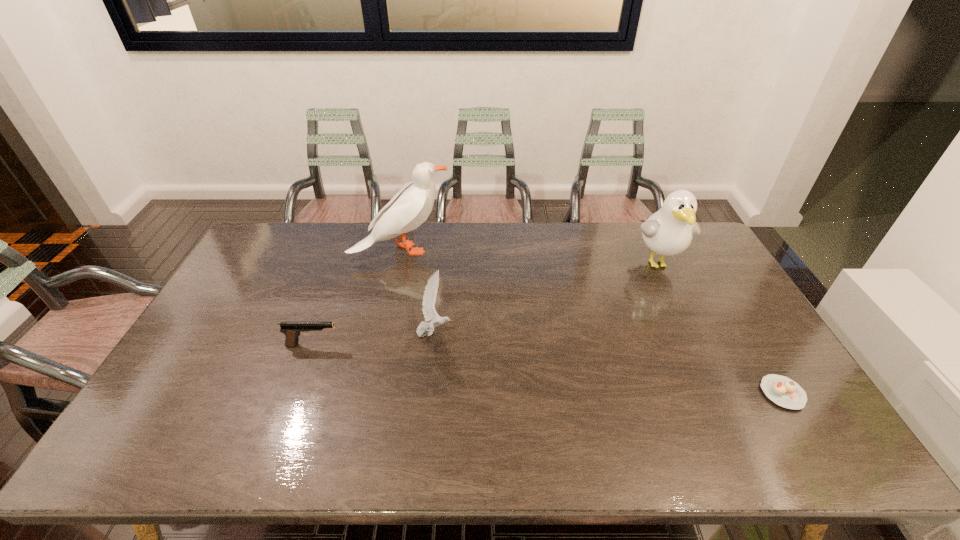
The height and width of the screenshot is (540, 960). Identify the location of the second object from right to left. (668, 232).

Find the location of `the nearest gull`. the nearest gull is located at coordinates (429, 298).

Identify the location of the shortest gull. The height and width of the screenshot is (540, 960). (429, 298).

The image size is (960, 540). Find the location of `the fourth tallest object`. the fourth tallest object is located at coordinates (292, 330).

Where is `the rightmost object`? The width and height of the screenshot is (960, 540). the rightmost object is located at coordinates (783, 391).

Locate an element on the screen. cupcake is located at coordinates (783, 391).

You are a GUI agent. You are given a task and a screenshot of the screen. Output one action in this format:
    pyautogui.click(x=<x>, y=<y>)
    Task: Click on the vacant region located 0.120m on the beak of the rightmost gull
    The image size is (960, 540).
    Given the screenshot: What is the action you would take?
    pyautogui.click(x=681, y=310)

Where is `free space located at the tip of the beak of the third shortest object`? This screenshot has width=960, height=540. free space located at the tip of the beak of the third shortest object is located at coordinates (586, 333).

I want to click on vacant space located at the muzzle of the pistol, so click(472, 345).

The height and width of the screenshot is (540, 960). I want to click on vacant point located on the back of the shortest object, so click(759, 356).